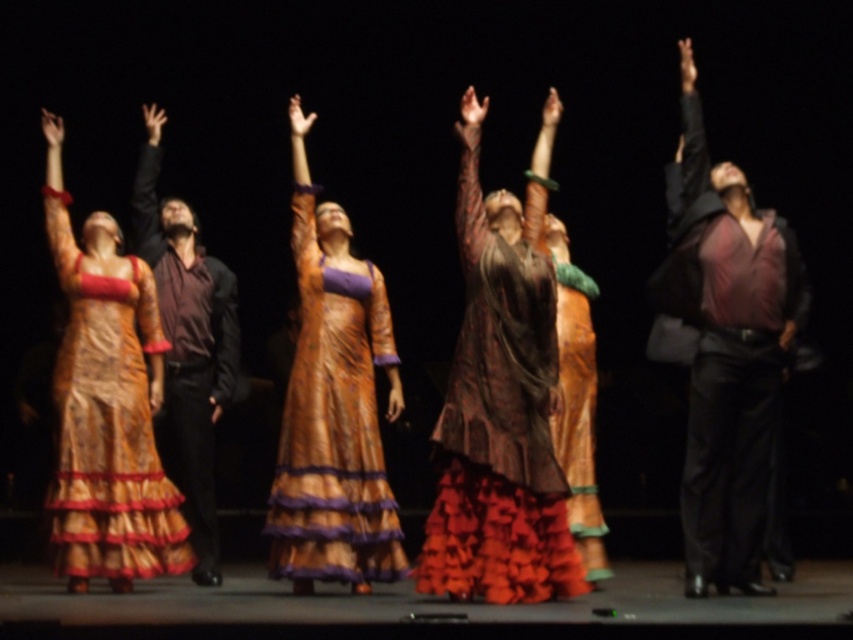
You are a photographer setting up a camera on the stage. You need to capture both the silky gold dress at left and the matte brown shirt at left in your shot. Which of the two items is shorter in height?

The silky gold dress at left has a lesser height compared to the matte brown shirt at left, so the silky gold dress at left is shorter in height.

You are a photographer positioned at the back of the stage. You need to capture a closeup shot of both the matte brown dress at center and the matte burgundy shirt at center. Considering their positions and sizes, which one might require you to move closer to get a clear focus?

The matte brown dress at center might be wider than the matte burgundy shirt at center, so you might need to move closer to the matte brown dress at center to capture its details clearly.

You are a photographer trying to capture the dancers. You notice the matte brown dress at center and the matte burgundy shirt at center. Which one appears shorter in the image?

The matte brown dress at center is not as tall as the matte burgundy shirt at center, so the matte brown dress at center appears shorter.